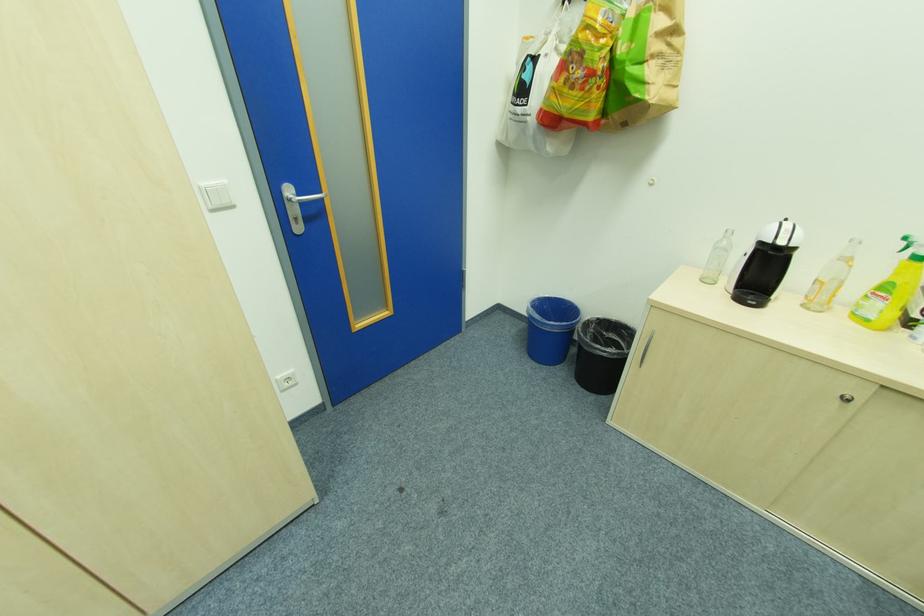
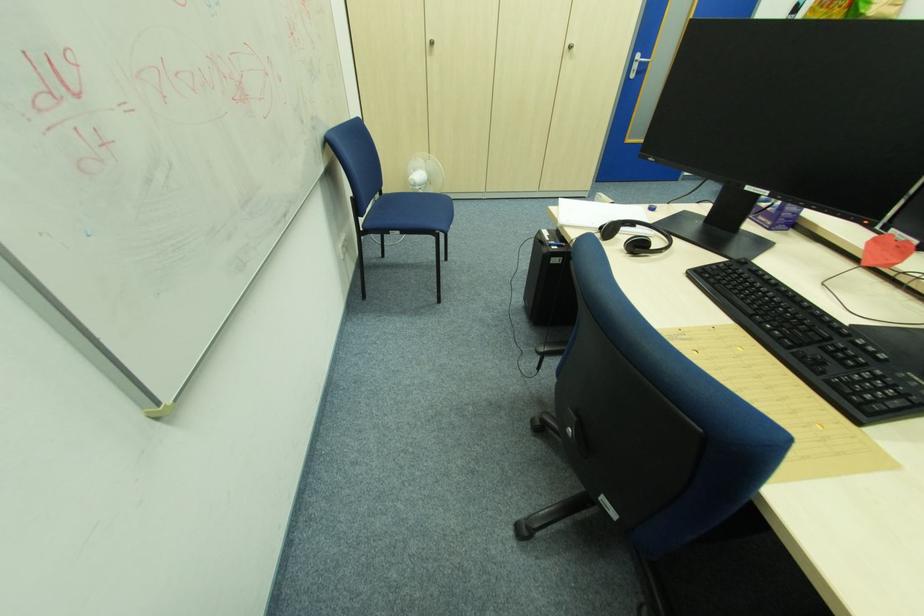
In the second image, find the point that corresponds to [304,196] in the first image.

(647, 61)